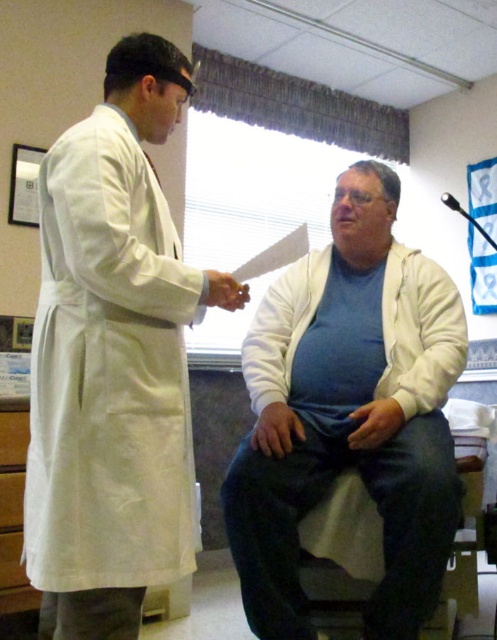
You are a patient in a clinic and need to choose between the white matte jacket at center and the white fleece jacket at center to wear before an outdoor appointment. If the jackets are placed side by side, which one is farther from the clinic door located to the left of the room?

The distance between the white matte jacket at center and the white fleece jacket at center is 3.93 inches, but the description does not provide information about their positions relative to the clinic door. Therefore, it is impossible to determine which jacket is farther from the door based on the given information.

You are a healthcare worker needing to choose between the white smooth lab coat at left and the white fleece jacket at center for a cold day. Based on their sizes, which one is wider?

The white fleece jacket at center is wider than the white smooth lab coat at left since the white smooth lab coat at left has a smaller width.

You are a patient in this medical office and need to locate the two specific points marked in the room. From your perspective, which point is closer to you? The points are labeled as point (137, 524) and point (274, 486).

Point (137, 524) is in front of point (274, 486), so it is closer to you.